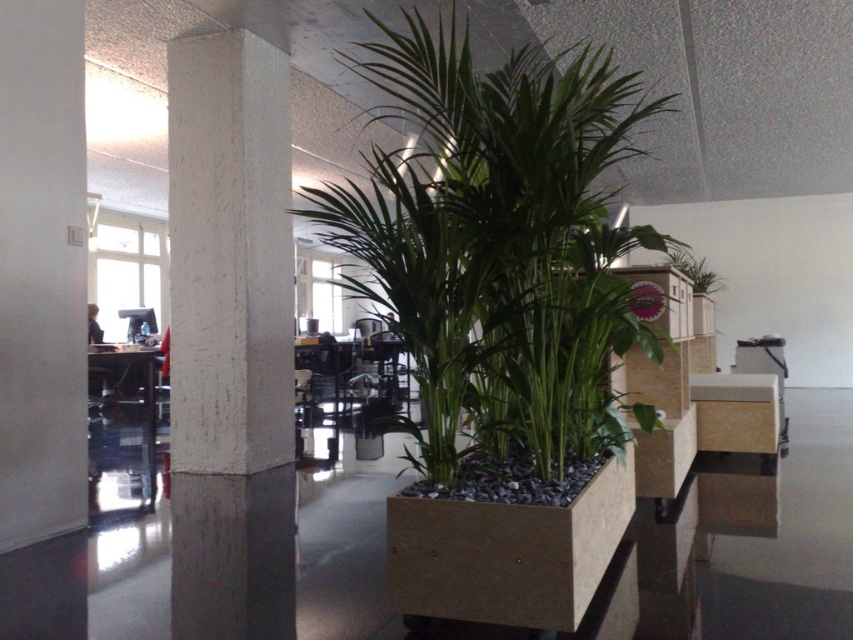
Does white textured pillar at center have a smaller size compared to green leafy plant at upper center?

No.

Is white textured pillar at center thinner than green leafy plant at upper center?

Yes, white textured pillar at center is thinner than green leafy plant at upper center.

What do you see at coordinates (230, 339) in the screenshot? I see `white textured pillar at center` at bounding box center [230, 339].

You are a GUI agent. You are given a task and a screenshot of the screen. Output one action in this format:
    pyautogui.click(x=<x>, y=<y>)
    Task: Click on the white textured pillar at center
    The width and height of the screenshot is (853, 640).
    Given the screenshot: What is the action you would take?
    pyautogui.click(x=230, y=339)